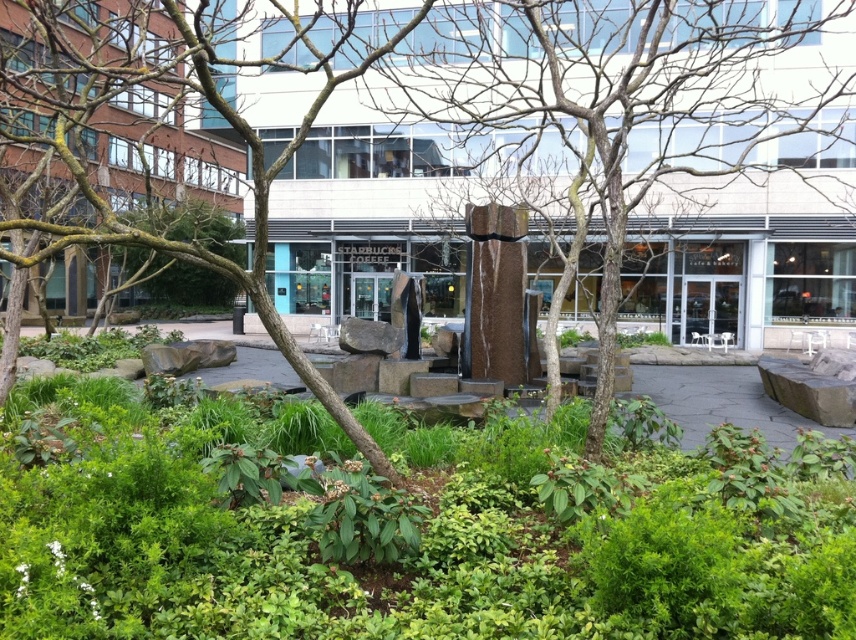
Question: Does smooth bark tree at lower left have a lesser width compared to green leafy bush at center?

Choices:
 (A) no
 (B) yes

Answer: (B)

Question: Among these objects, which one is farthest from the camera?

Choices:
 (A) brown stone fountain at center
 (B) polished bronze statue at center
 (C) bare branches at center

Answer: (B)

Question: Does brown stone fountain at center have a smaller size compared to polished bronze statue at center?

Choices:
 (A) yes
 (B) no

Answer: (B)

Question: Among these objects, which one is nearest to the camera?

Choices:
 (A) brown stone fountain at center
 (B) polished bronze statue at center
 (C) bare branches at center

Answer: (C)

Question: Considering the relative positions of brown stone fountain at center and green leafy bush at center in the image provided, where is brown stone fountain at center located with respect to green leafy bush at center?

Choices:
 (A) right
 (B) left

Answer: (A)

Question: Which point is closer to the camera?

Choices:
 (A) smooth bark tree at lower left
 (B) green leafy bush at center
 (C) bare branches at center
 (D) brown stone fountain at center

Answer: (A)